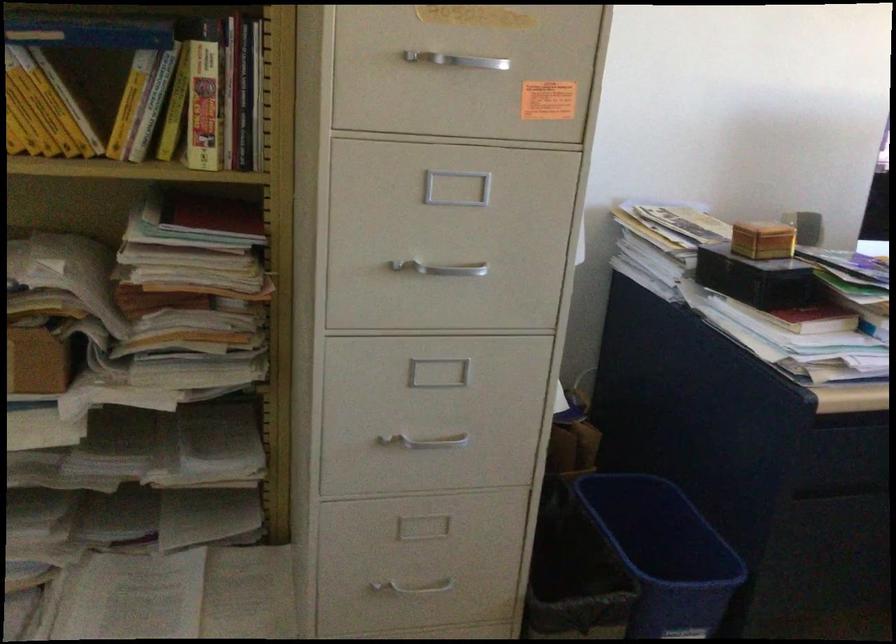
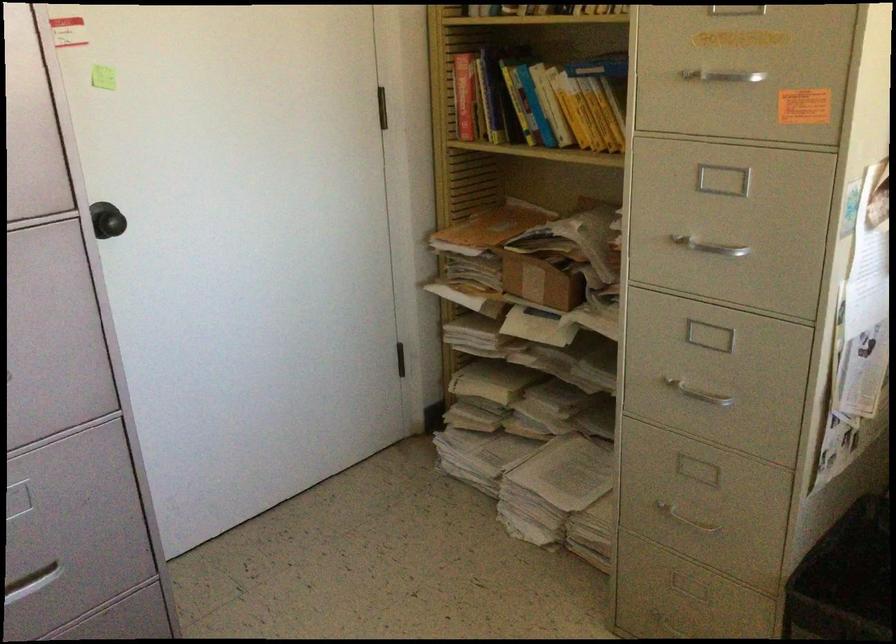
The point at (448, 265) is marked in the first image. Where is the corresponding point in the second image?

(710, 248)